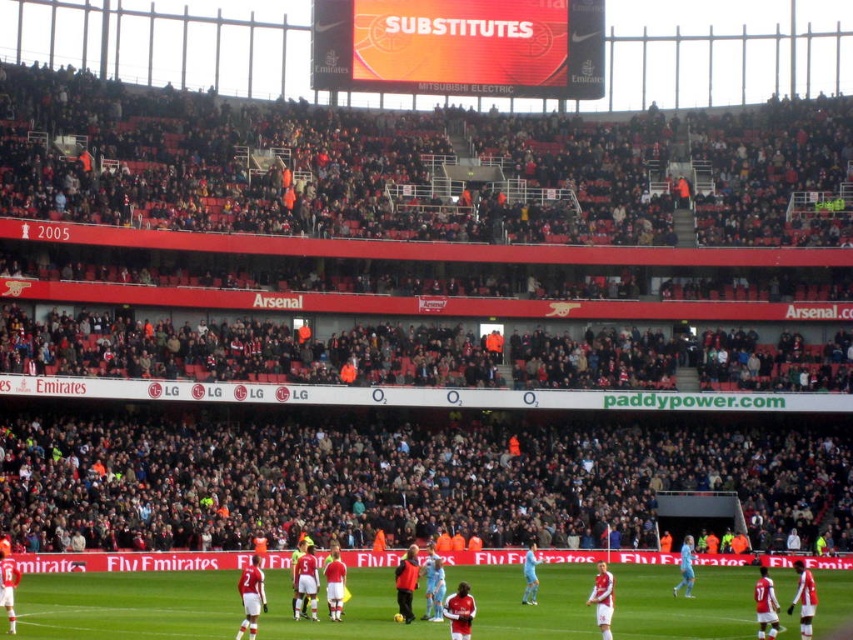
Question: Which object appears farthest from the camera in this image?

Choices:
 (A) red matte scoreboard at upper center
 (B) green grass football field at center

Answer: (A)

Question: Can you confirm if green grass football field at center is wider than red matte scoreboard at upper center?

Choices:
 (A) no
 (B) yes

Answer: (B)

Question: Does green grass football field at center have a greater width compared to red matte scoreboard at upper center?

Choices:
 (A) no
 (B) yes

Answer: (B)

Question: Does green grass football field at center appear on the left side of red matte scoreboard at upper center?

Choices:
 (A) no
 (B) yes

Answer: (A)

Question: Which point appears farthest from the camera in this image?

Choices:
 (A) (650, 605)
 (B) (310, 67)

Answer: (B)

Question: Which point is farther to the camera?

Choices:
 (A) green grass football field at center
 (B) red matte scoreboard at upper center

Answer: (B)